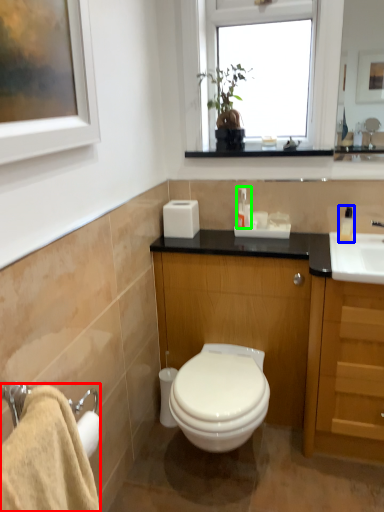
Question: Considering the real-world distances, which object is farthest from bath towel (highlighted by a red box)? soap dispenser (highlighted by a blue box) or toiletry (highlighted by a green box)?

Choices:
 (A) soap dispenser
 (B) toiletry

Answer: (A)